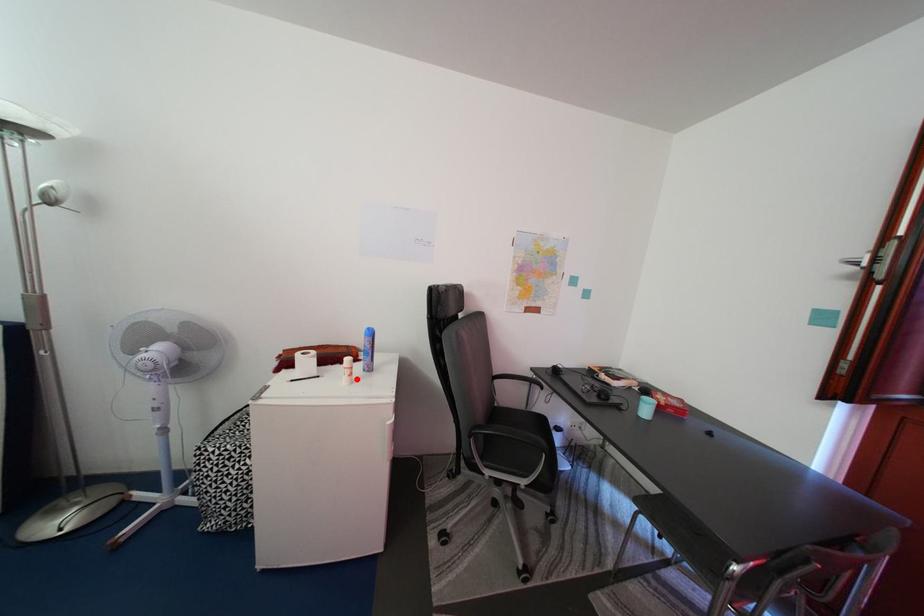
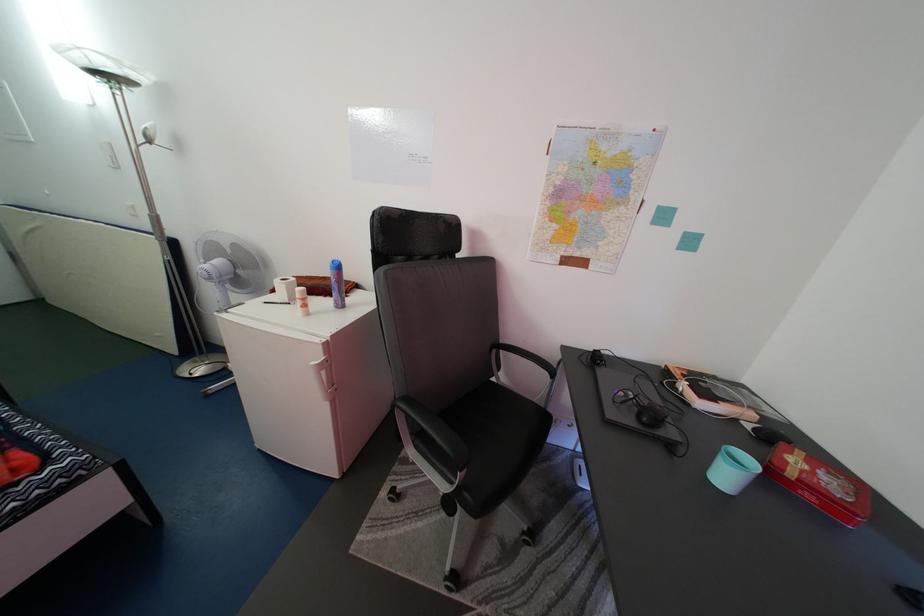
The point at the highlighted location is marked in the first image. Where is the corresponding point in the second image?

(308, 310)